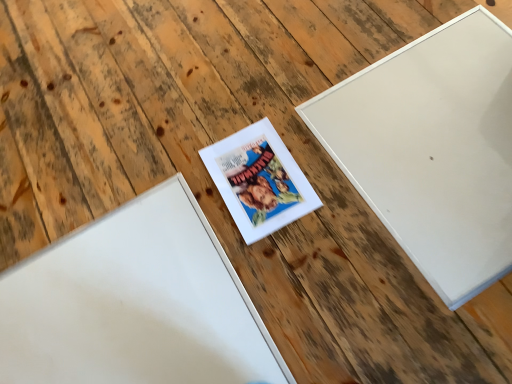
Question: Which direction should I rotate to look at white matte picture frame at center, positioned as the first picture frame in left-to-right order, — up or down?

Choices:
 (A) up
 (B) down

Answer: (B)

Question: Can you confirm if white matte picture frame at center, positioned as the first picture frame in left-to-right order, is shorter than white matte picture frame at upper right, arranged as the first picture frame when viewed from the right?

Choices:
 (A) no
 (B) yes

Answer: (A)

Question: Considering the relative positions of white matte picture frame at center, the 3th picture frame in the right-to-left sequence, and white matte picture frame at upper right, arranged as the first picture frame when viewed from the right, in the image provided, is white matte picture frame at center, the 3th picture frame in the right-to-left sequence, to the left of white matte picture frame at upper right, arranged as the first picture frame when viewed from the right, from the viewer's perspective?

Choices:
 (A) yes
 (B) no

Answer: (A)

Question: Is white matte picture frame at center, positioned as the first picture frame in left-to-right order, looking in the opposite direction of white matte picture frame at upper right, which appears as the third picture frame when viewed from the left?

Choices:
 (A) yes
 (B) no

Answer: (B)

Question: From the image's perspective, is white matte picture frame at center, the 3th picture frame in the right-to-left sequence, located beneath white matte picture frame at upper right, which appears as the third picture frame when viewed from the left?

Choices:
 (A) yes
 (B) no

Answer: (A)

Question: Is white matte picture frame at center, the 3th picture frame in the right-to-left sequence, closer to camera compared to white matte picture frame at upper right, arranged as the first picture frame when viewed from the right?

Choices:
 (A) no
 (B) yes

Answer: (B)

Question: From a real-world perspective, is white matte picture frame at center, the 3th picture frame in the right-to-left sequence, positioned over white matte picture frame at upper right, which appears as the third picture frame when viewed from the left, based on gravity?

Choices:
 (A) yes
 (B) no

Answer: (B)

Question: Is white matte picture frame at center, which is the second picture frame from left to right, next to white matte picture frame at center, the 3th picture frame in the right-to-left sequence?

Choices:
 (A) no
 (B) yes

Answer: (A)

Question: Does white matte picture frame at center, positioned as the 2th picture frame in right-to-left order, lie in front of white matte picture frame at center, positioned as the first picture frame in left-to-right order?

Choices:
 (A) no
 (B) yes

Answer: (A)

Question: Considering the relative sizes of white matte picture frame at center, which is the second picture frame from left to right, and white matte picture frame at center, positioned as the first picture frame in left-to-right order, in the image provided, is white matte picture frame at center, which is the second picture frame from left to right, smaller than white matte picture frame at center, positioned as the first picture frame in left-to-right order,?

Choices:
 (A) no
 (B) yes

Answer: (B)

Question: Is white matte picture frame at center, which is the second picture frame from left to right, oriented away from white matte picture frame at center, positioned as the first picture frame in left-to-right order?

Choices:
 (A) yes
 (B) no

Answer: (B)

Question: Is white matte picture frame at center, which is the second picture frame from left to right, outside white matte picture frame at center, positioned as the first picture frame in left-to-right order?

Choices:
 (A) no
 (B) yes

Answer: (B)

Question: Is white matte picture frame at center, the 3th picture frame in the right-to-left sequence, inside white matte picture frame at center, which is the second picture frame from left to right?

Choices:
 (A) yes
 (B) no

Answer: (B)

Question: Is white matte picture frame at upper right, arranged as the first picture frame when viewed from the right, at the right side of white matte picture frame at center, positioned as the first picture frame in left-to-right order?

Choices:
 (A) yes
 (B) no

Answer: (A)